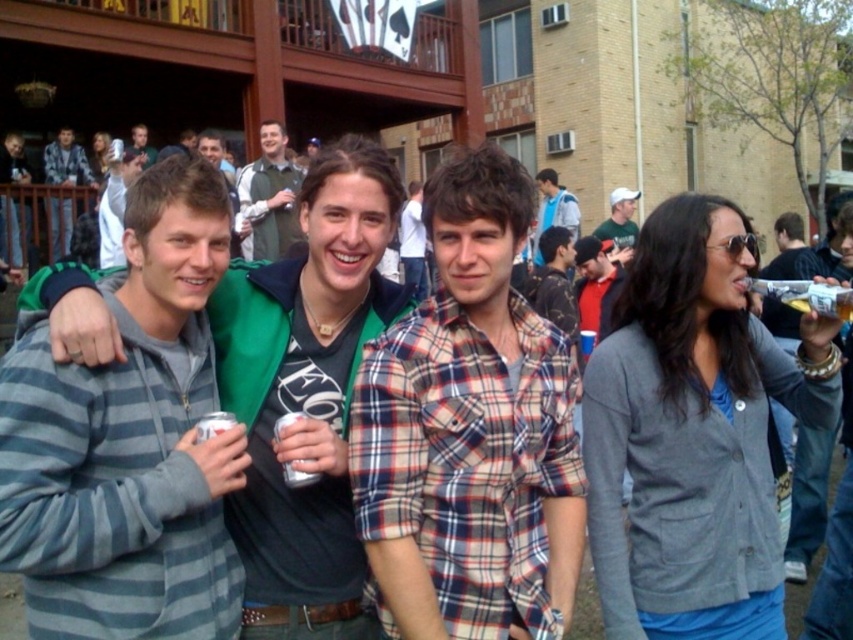
Question: Does plaid cotton shirt at center appear under striped fleece jacket at center?

Choices:
 (A) yes
 (B) no

Answer: (A)

Question: Does green fabric vest at upper center appear under plaid shirt at center?

Choices:
 (A) yes
 (B) no

Answer: (A)

Question: Among these objects, which one is nearest to the camera?

Choices:
 (A) plaid fabric shirt at center
 (B) green fabric vest at upper center
 (C) plaid cotton shirt at center

Answer: (C)

Question: Observing the image, what is the correct spatial positioning of plaid cotton shirt at center in reference to matte black jacket at upper left?

Choices:
 (A) above
 (B) below

Answer: (B)

Question: Which point is farther from the camera taking this photo?

Choices:
 (A) (524, 323)
 (B) (850, 442)
 (C) (138, 134)
 (D) (265, 120)

Answer: (C)

Question: Among these objects, which one is farthest from the camera?

Choices:
 (A) plaid shirt at center
 (B) metallic silver can at center

Answer: (A)